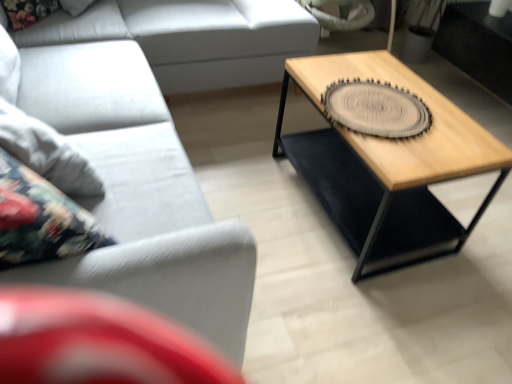
Question: Should I look upward or downward to see light gray fabric couch at left, marked as the 2th studio couch in a front-to-back arrangement?

Choices:
 (A) down
 (B) up

Answer: (B)

Question: From the image's perspective, is light gray fabric couch at left, marked as the 2th studio couch in a front-to-back arrangement, located above gray textured coaster at center right?

Choices:
 (A) yes
 (B) no

Answer: (A)

Question: Is light gray fabric couch at left, the 1th studio couch positioned from the back, facing towards gray textured coaster at center right?

Choices:
 (A) no
 (B) yes

Answer: (A)

Question: Is light gray fabric couch at left, the 1th studio couch positioned from the back, in front of gray textured coaster at center right?

Choices:
 (A) no
 (B) yes

Answer: (A)

Question: Does light gray fabric couch at left, marked as the 2th studio couch in a front-to-back arrangement, appear on the right side of gray textured coaster at center right?

Choices:
 (A) no
 (B) yes

Answer: (A)

Question: Can you confirm if light gray fabric couch at left, the 1th studio couch positioned from the back, is smaller than gray textured coaster at center right?

Choices:
 (A) yes
 (B) no

Answer: (B)

Question: Considering the relative sizes of light gray fabric couch at left, the 1th studio couch positioned from the back, and gray textured coaster at center right in the image provided, is light gray fabric couch at left, the 1th studio couch positioned from the back, wider than gray textured coaster at center right?

Choices:
 (A) no
 (B) yes

Answer: (B)

Question: Is wooden/black metal coffee table at right turned away from light gray fabric couch at left, the 1th studio couch positioned from the back?

Choices:
 (A) yes
 (B) no

Answer: (B)

Question: Can you confirm if wooden/black metal coffee table at right is shorter than light gray fabric couch at left, marked as the 2th studio couch in a front-to-back arrangement?

Choices:
 (A) no
 (B) yes

Answer: (B)

Question: Considering the relative sizes of wooden/black metal coffee table at right and light gray fabric couch at left, the 1th studio couch positioned from the back, in the image provided, is wooden/black metal coffee table at right bigger than light gray fabric couch at left, the 1th studio couch positioned from the back,?

Choices:
 (A) yes
 (B) no

Answer: (B)

Question: Would you say light gray fabric couch at left, the 1th studio couch positioned from the back, is part of wooden/black metal coffee table at right's contents?

Choices:
 (A) no
 (B) yes

Answer: (A)

Question: Is there a large distance between wooden/black metal coffee table at right and light gray fabric couch at left, the 1th studio couch positioned from the back?

Choices:
 (A) yes
 (B) no

Answer: (B)

Question: Is wooden/black metal coffee table at right wider than light gray fabric couch at left, the 1th studio couch positioned from the back?

Choices:
 (A) no
 (B) yes

Answer: (A)

Question: From the image's perspective, would you say gray textured coaster at center right is shown under matte gray couch at lower left, which ranks as the 1th studio couch in front-to-back order?

Choices:
 (A) no
 (B) yes

Answer: (A)